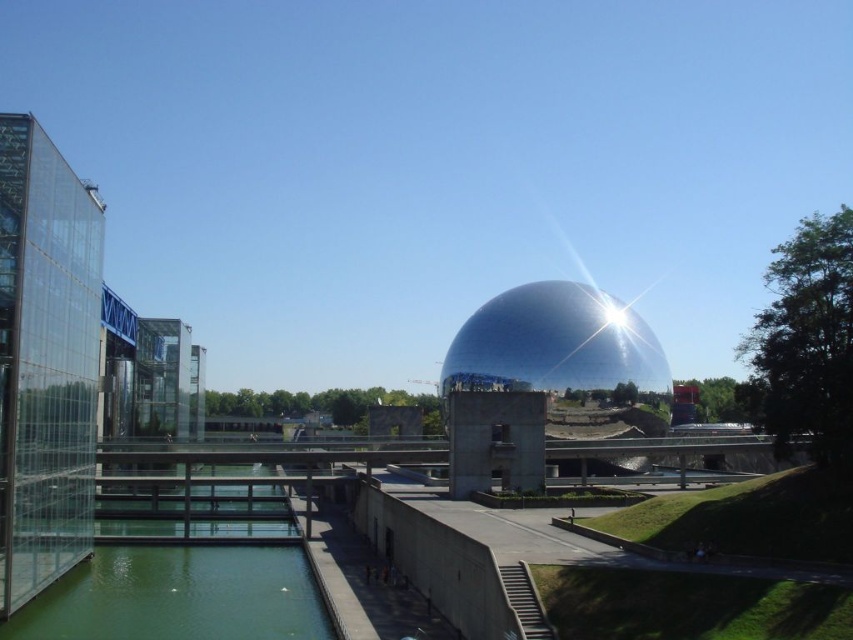
Which is above, green glass water at lower left or glossy metallic dome at center?

glossy metallic dome at center is higher up.

Can you confirm if green glass water at lower left is thinner than glossy metallic dome at center?

Correct, green glass water at lower left's width is less than glossy metallic dome at center's.

Between point (109, 589) and point (581, 312), which one is positioned in front?

Positioned in front is point (109, 589).

I want to click on green glass water at lower left, so click(x=178, y=596).